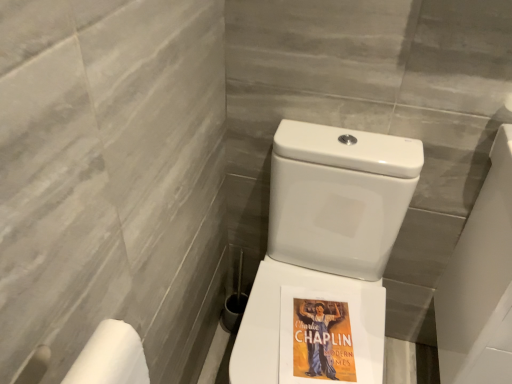
Question: From a real-world perspective, is white glossy porcelain at right on white matte toilet paper at lower left?

Choices:
 (A) yes
 (B) no

Answer: (B)

Question: Considering the relative sizes of white glossy porcelain at right and white matte toilet paper at lower left in the image provided, is white glossy porcelain at right taller than white matte toilet paper at lower left?

Choices:
 (A) no
 (B) yes

Answer: (B)

Question: Considering the relative sizes of white glossy porcelain at right and white matte toilet paper at lower left in the image provided, is white glossy porcelain at right thinner than white matte toilet paper at lower left?

Choices:
 (A) yes
 (B) no

Answer: (B)

Question: Is white glossy porcelain at right not near white matte toilet paper at lower left?

Choices:
 (A) yes
 (B) no

Answer: (B)

Question: Is white glossy porcelain at right turned away from white matte toilet paper at lower left?

Choices:
 (A) yes
 (B) no

Answer: (B)

Question: Is white matte toilet paper at lower left in front of or behind white glossy toilet at center in the image?

Choices:
 (A) behind
 (B) front

Answer: (B)

Question: Considering the relative positions of white matte toilet paper at lower left and white glossy toilet at center in the image provided, is white matte toilet paper at lower left to the left or to the right of white glossy toilet at center?

Choices:
 (A) left
 (B) right

Answer: (A)

Question: Considering the positions of white matte toilet paper at lower left and white glossy toilet at center in the image, is white matte toilet paper at lower left wider or thinner than white glossy toilet at center?

Choices:
 (A) wide
 (B) thin

Answer: (B)

Question: Does point (128, 367) appear closer or farther from the camera than point (324, 178)?

Choices:
 (A) farther
 (B) closer

Answer: (B)

Question: Which is correct: white glossy toilet at center is inside white glossy porcelain at right, or outside of it?

Choices:
 (A) inside
 (B) outside

Answer: (B)

Question: From a real-world perspective, is white glossy toilet at center physically located above or below white glossy porcelain at right?

Choices:
 (A) above
 (B) below

Answer: (B)

Question: Is white glossy toilet at center taller or shorter than white glossy porcelain at right?

Choices:
 (A) tall
 (B) short

Answer: (A)

Question: From the image's perspective, is white glossy toilet at center positioned above or below white glossy porcelain at right?

Choices:
 (A) above
 (B) below

Answer: (B)

Question: Is white matte toilet paper at lower left spatially inside white glossy porcelain at right, or outside of it?

Choices:
 (A) outside
 (B) inside

Answer: (A)

Question: Is white matte toilet paper at lower left in front of or behind white glossy porcelain at right in the image?

Choices:
 (A) front
 (B) behind

Answer: (A)